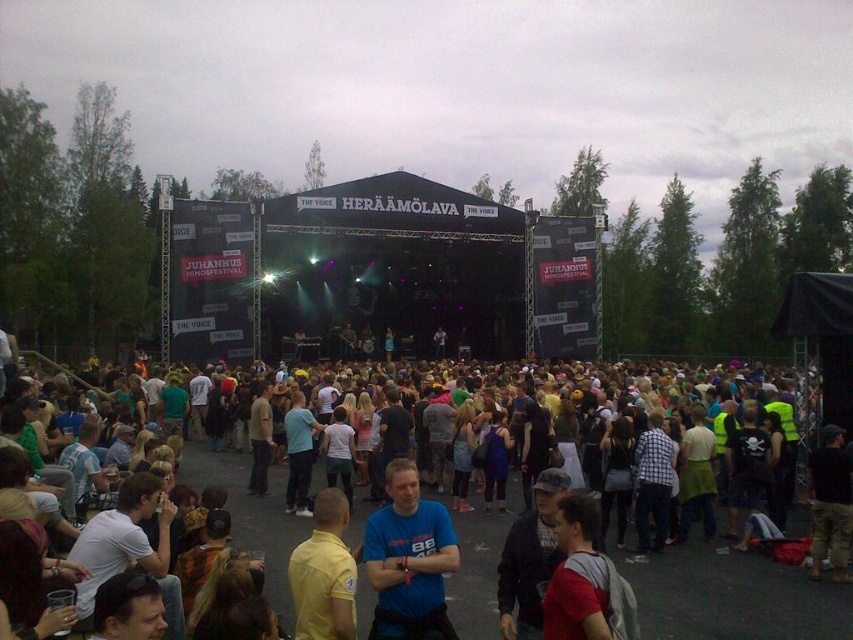
Is point (656, 618) in front of point (338, 516)?

No, it is behind (338, 516).

Who is more forward, (685,381) or (325,524)?

Positioned in front is point (325,524).

Find the location of a particular element. This screenshot has height=640, width=853. multicolored casual clothing at center is located at coordinates (730, 589).

Is multicolored casual clothing at center positioned in front of blue matte shirt at center?

Yes.

This screenshot has height=640, width=853. Identify the location of multicolored casual clothing at center. (730, 589).

Between point (415, 634) and point (328, 586), which one is positioned behind?

The point (415, 634) is more distant.

Who is taller, blue matte shirt at center or yellow matte shirt at center?

With more height is blue matte shirt at center.

Measure the distance between blue matte shirt at center and camera.

blue matte shirt at center and camera are 62.32 meters apart from each other.

Where is `blue matte shirt at center`? Image resolution: width=853 pixels, height=640 pixels. blue matte shirt at center is located at coordinates (409, 560).